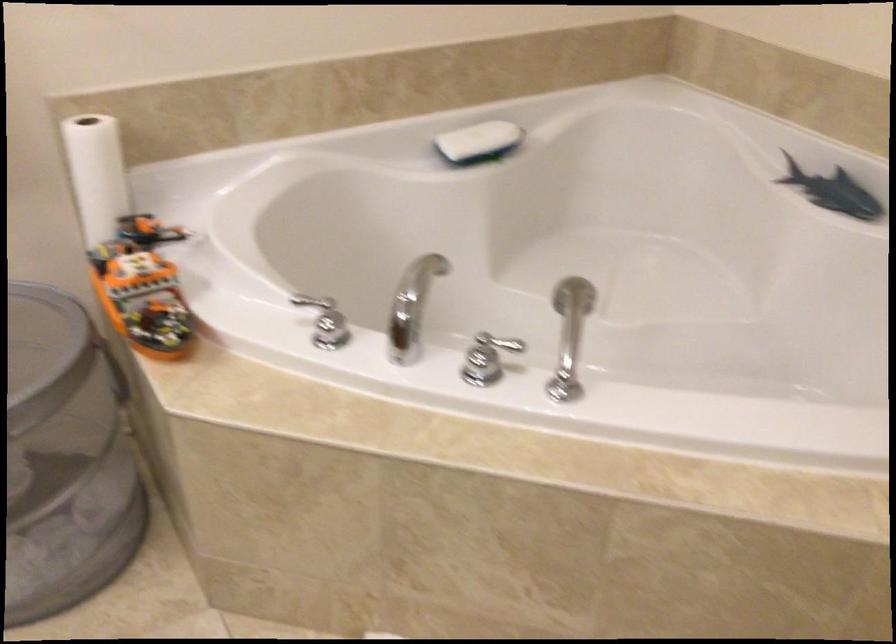
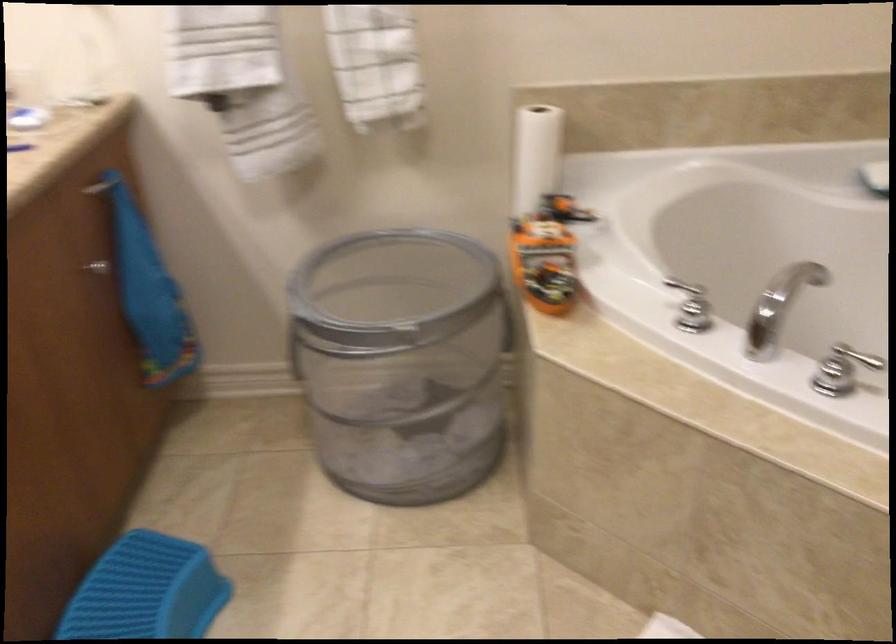
In the second image, find the point that corresponds to (124,375) in the first image.

(506, 322)